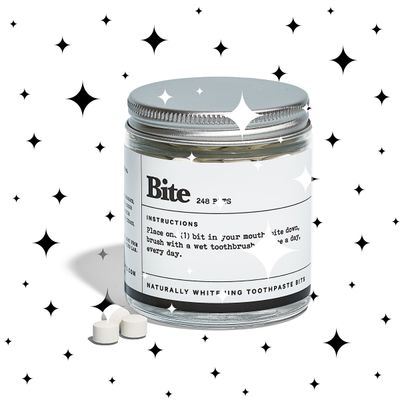
Where is `jar`? Image resolution: width=400 pixels, height=400 pixels. jar is located at coordinates (212, 155), (226, 319).